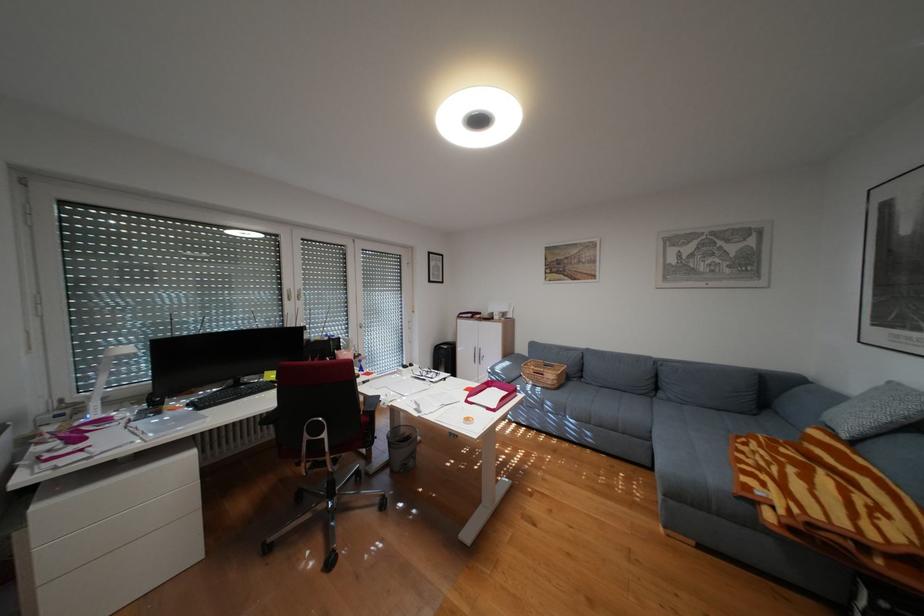
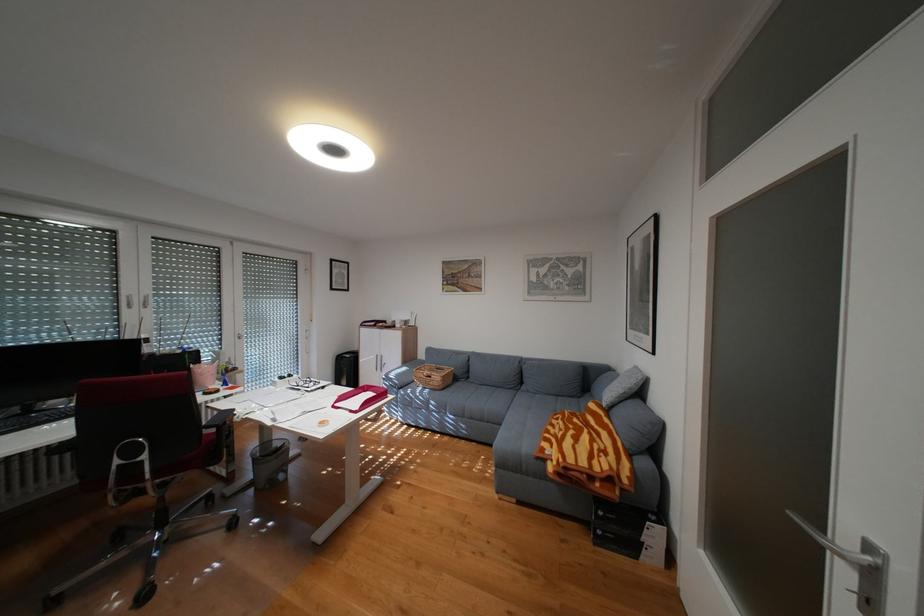
In the second image, find the point that corresponds to pixel 420 438 in the first image.

(288, 451)